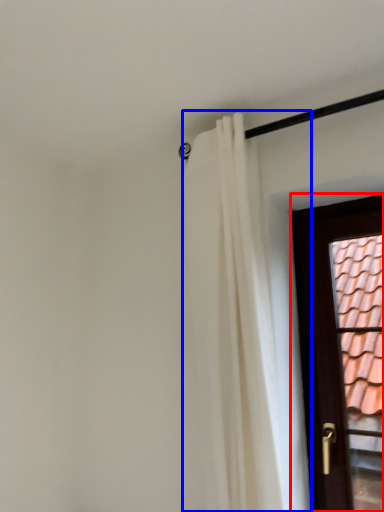
Question: Which object is closer to the camera taking this photo, door (highlighted by a red box) or curtain (highlighted by a blue box)?

Choices:
 (A) door
 (B) curtain

Answer: (B)